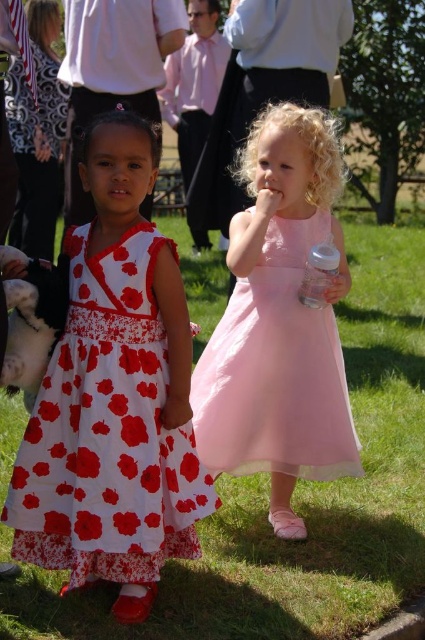
Is point (422, 508) behind point (198, 369)?

Yes, point (422, 508) is farther from viewer.

Between green grass at lower center and pink tulle dress at center, which one appears on the right side from the viewer's perspective?

pink tulle dress at center

Image resolution: width=425 pixels, height=640 pixels. What do you see at coordinates (297, 500) in the screenshot?
I see `green grass at lower center` at bounding box center [297, 500].

The width and height of the screenshot is (425, 640). In order to click on green grass at lower center in this screenshot , I will do `click(297, 500)`.

Is green grass at lower center smaller than transparent plastic bottle at right?

Actually, green grass at lower center might be larger than transparent plastic bottle at right.

Can you confirm if green grass at lower center is taller than transparent plastic bottle at right?

Incorrect, green grass at lower center's height is not larger of transparent plastic bottle at right's.

Describe the element at coordinates (297, 500) in the screenshot. The image size is (425, 640). I see `green grass at lower center` at that location.

Where is `green grass at lower center`? This screenshot has width=425, height=640. green grass at lower center is located at coordinates (297, 500).

Can you confirm if green grass at lower center is positioned to the left of white floral dress at left?

No, green grass at lower center is not to the left of white floral dress at left.

Can you confirm if green grass at lower center is shorter than white floral dress at left?

Correct, green grass at lower center is not as tall as white floral dress at left.

Where is `green grass at lower center`? The image size is (425, 640). green grass at lower center is located at coordinates (297, 500).